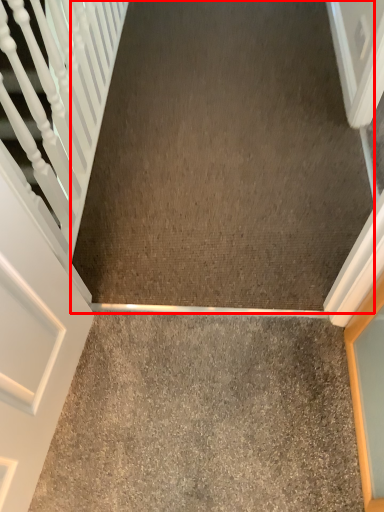
Question: From the image's perspective, considering the relative positions of concrete (annotated by the red box) and concrete in the image provided, where is concrete (annotated by the red box) located with respect to the staircase?

Choices:
 (A) above
 (B) below

Answer: (A)